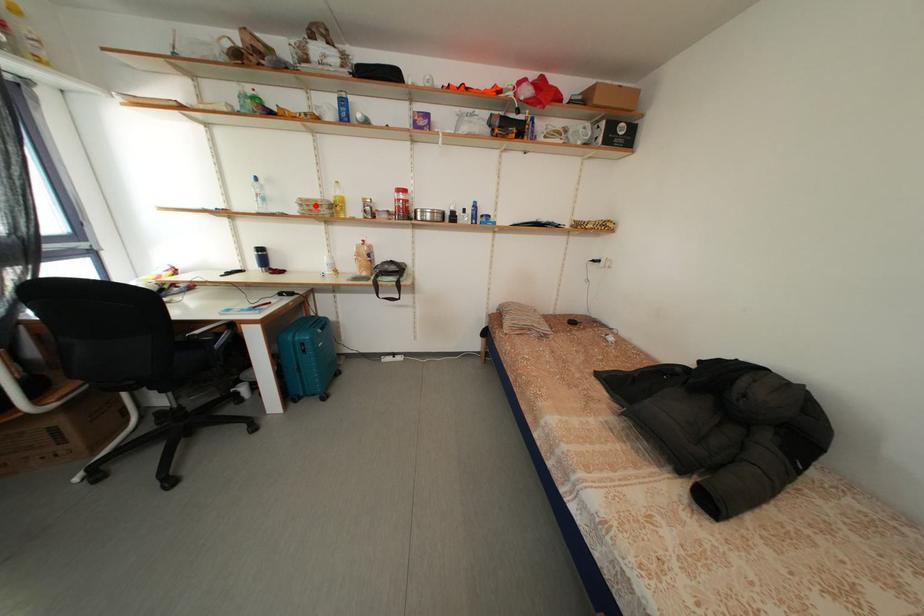
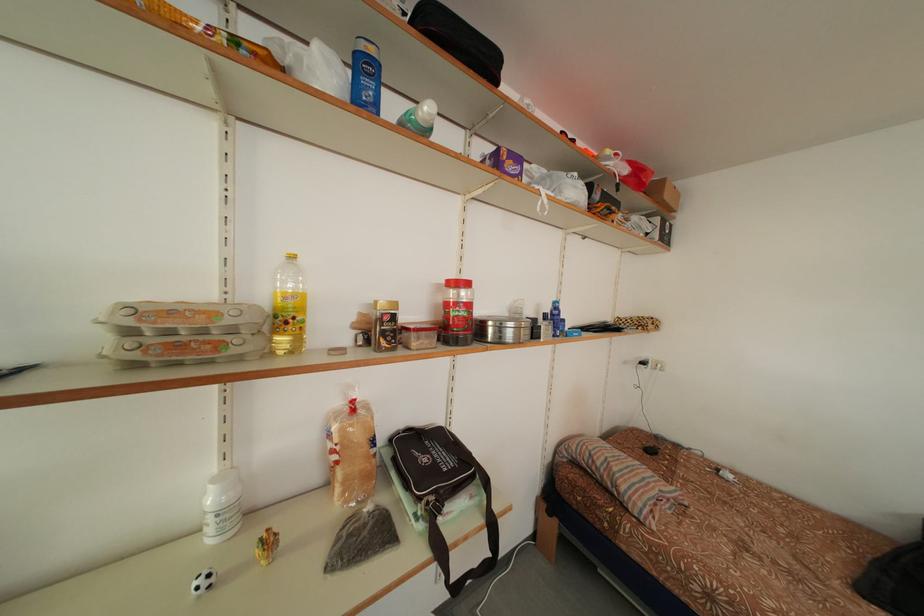
Find the pixel in the second image that matches the highlighted location in the first image.

(178, 317)